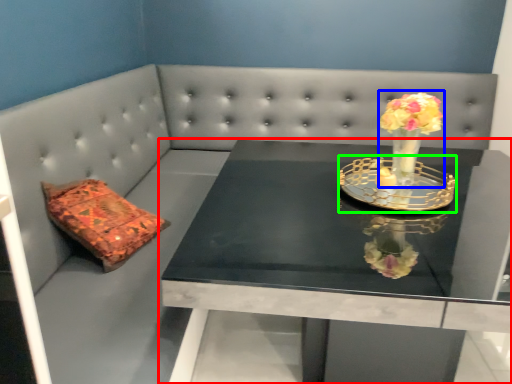
Question: Which object is positioned closest to table (highlighted by a red box)? Select from floral arrangement (highlighted by a blue box) and candle holder (highlighted by a green box).

Choices:
 (A) floral arrangement
 (B) candle holder

Answer: (B)